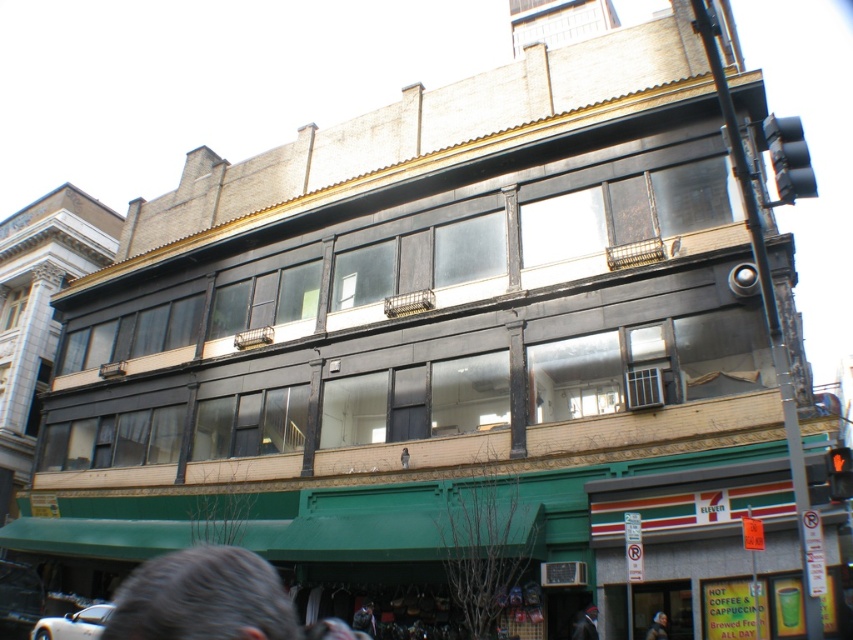
Question: Does gray matte hair at lower left have a greater width compared to smooth black hair at lower center?

Choices:
 (A) no
 (B) yes

Answer: (B)

Question: Which of the following is the closest to the observer?

Choices:
 (A) dark brown leather jacket at lower right
 (B) smooth black hair at lower center
 (C) gray matte hair at lower left

Answer: (C)

Question: Which object is farther from the camera taking this photo?

Choices:
 (A) smooth black hair at lower center
 (B) gray matte hair at lower left

Answer: (A)

Question: Where is gray matte hair at lower left located in relation to dark brown leather jacket at lower right in the image?

Choices:
 (A) left
 (B) right

Answer: (A)

Question: Which of these objects is positioned closest to the gray matte hair at lower left?

Choices:
 (A) dark brown leather jacket at lower right
 (B) smooth black hair at lower center

Answer: (B)

Question: Where is smooth black hair at lower center located in relation to dark brown leather jacket at lower right in the image?

Choices:
 (A) above
 (B) below

Answer: (B)